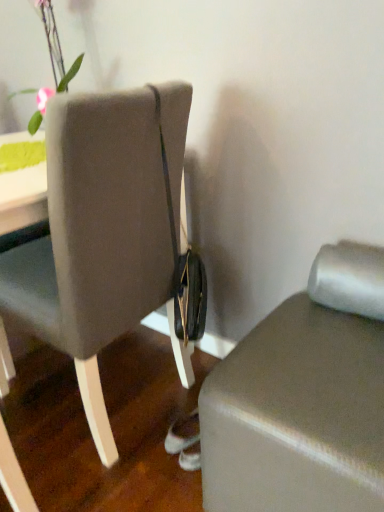
I want to click on vacant area on top of matte gray ottoman at lower right (from a real-world perspective), so click(314, 366).